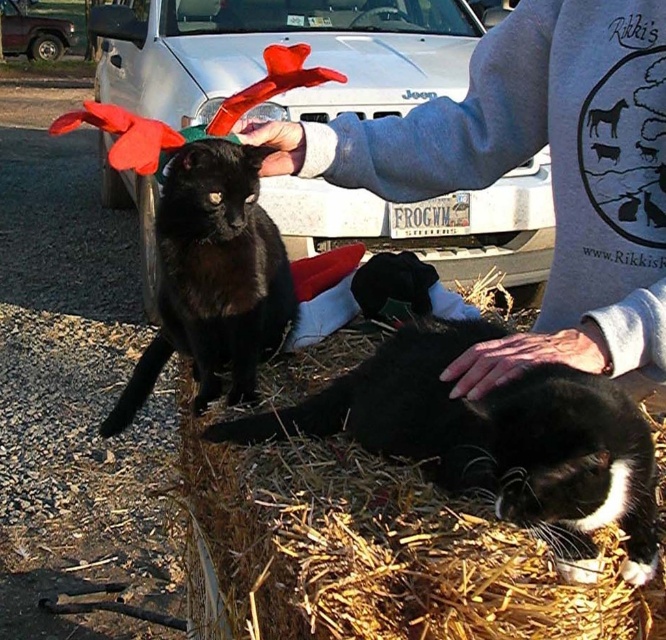
Question: Is gray sweatshirt at upper center below black fur cat at lower right?

Choices:
 (A) no
 (B) yes

Answer: (A)

Question: Is black fur cat at lower right thinner than black matte fur cat at upper left?

Choices:
 (A) yes
 (B) no

Answer: (B)

Question: Is black fur cat at lower right bigger than black matte fur cat at upper left?

Choices:
 (A) no
 (B) yes

Answer: (A)

Question: Among these points, which one is nearest to the camera?

Choices:
 (A) (557, 492)
 (B) (527, 26)
 (C) (238, 288)

Answer: (A)

Question: Which point is closer to the camera?

Choices:
 (A) gray sweatshirt at upper center
 (B) black fur cat at lower right
 (C) black matte fur cat at upper left

Answer: (B)

Question: Which object is positioned farthest from the black matte fur cat at upper left?

Choices:
 (A) black fur cat at lower right
 (B) gray sweatshirt at upper center

Answer: (A)